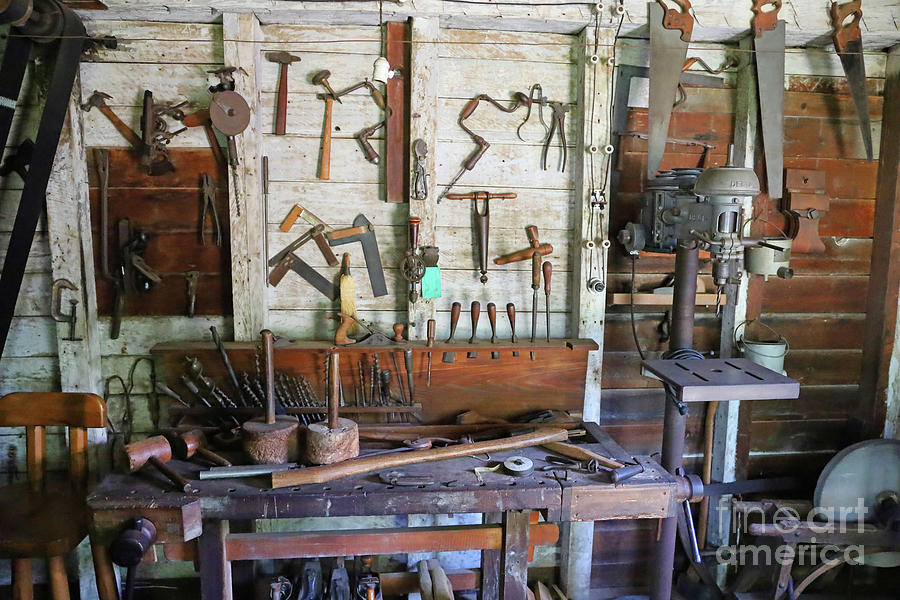
Identify the location of work bench. The width and height of the screenshot is (900, 600). (574, 495).